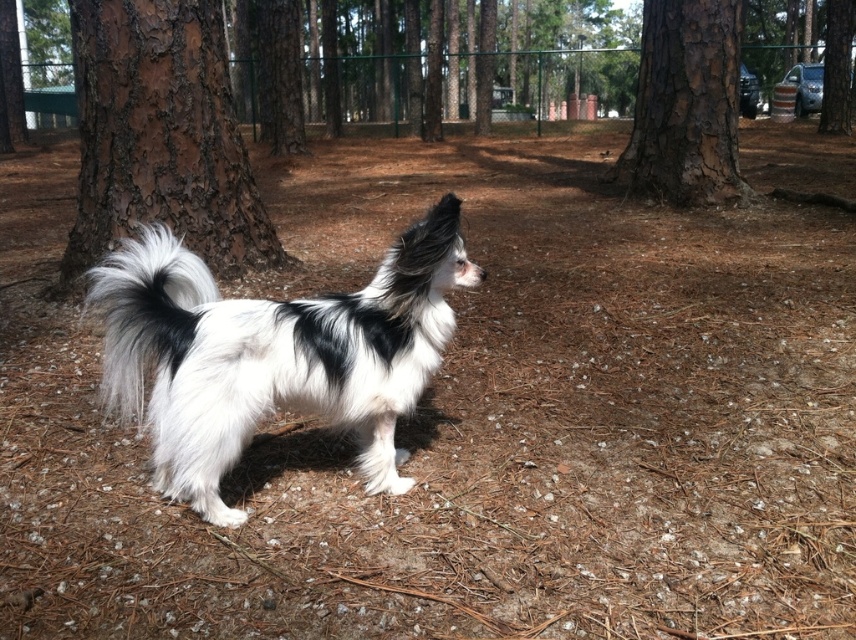
You are a small dog standing in a forest. You notice a brown rough bark at left and a white fluffy tail at center. Which object is higher up from the ground?

The brown rough bark at left is higher up from the ground than the white fluffy tail at center because it is positioned above it.

You are a photographer trying to capture a closeup of the white fluffy dog at center and the white fluffy tail at center. If you focus on the dog, will the tail also be in focus?

The white fluffy dog at center is bigger than white fluffy tail at center, so focusing on the dog will also keep the tail in focus since it is part of the same subject.

You are standing in the park and see two points marked in the scene. Which point is closer to you, point (x=122, y=64) or point (x=205, y=285)?

Point (x=205, y=285) is closer to you because it is less far from the camera than point (x=122, y=64).